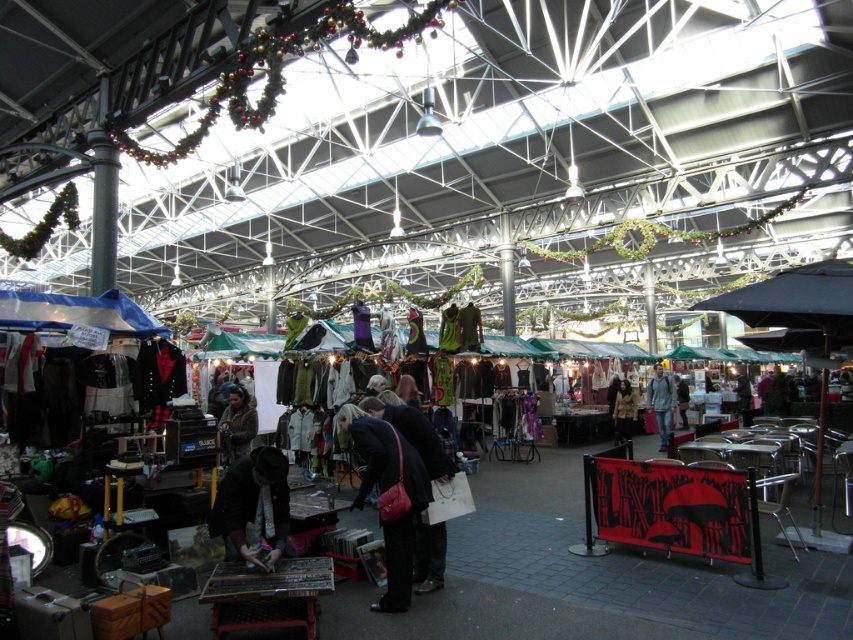
Question: Which of the following is the farthest from the observer?

Choices:
 (A) (651, 376)
 (B) (402, 476)
 (C) (241, 512)

Answer: (A)

Question: Estimate the real-world distances between objects in this image. Which object is farther from the brown wool coat at center?

Choices:
 (A) black fabric hat at lower center
 (B) dark blue fabric coat at center

Answer: (A)

Question: Does dark blue fabric coat at center have a lesser width compared to black fabric hat at lower center?

Choices:
 (A) no
 (B) yes

Answer: (A)

Question: Which object appears closest to the camera in this image?

Choices:
 (A) dark blue fabric coat at center
 (B) fuzzy brown coat at center
 (C) brown wool coat at center
 (D) black fabric hat at lower center

Answer: (D)

Question: Is the position of dark blue fabric coat at center less distant than that of light gray fabric jacket at center?

Choices:
 (A) no
 (B) yes

Answer: (B)

Question: Where is dark blue fabric coat at center located in relation to black fabric hat at lower center in the image?

Choices:
 (A) above
 (B) below

Answer: (B)